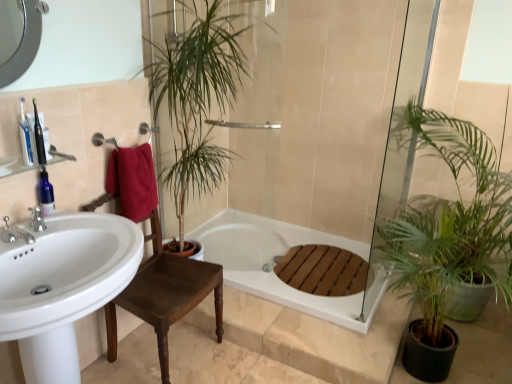
Question: Is brown wooden chair at center at the right side of brushed metal faucet at left, which appears as the 1th tap when viewed from the front?

Choices:
 (A) yes
 (B) no

Answer: (A)

Question: From a real-world perspective, is brown wooden chair at center under brushed metal faucet at left, which appears as the 1th tap when viewed from the front?

Choices:
 (A) yes
 (B) no

Answer: (A)

Question: Is brown wooden chair at center facing away from brushed metal faucet at left, which is the second tap in back-to-front order?

Choices:
 (A) no
 (B) yes

Answer: (A)

Question: From the image's perspective, is brown wooden chair at center under brushed metal faucet at left, which appears as the 1th tap when viewed from the front?

Choices:
 (A) yes
 (B) no

Answer: (A)

Question: Is brown wooden chair at center not close to brushed metal faucet at left, which is the second tap in back-to-front order?

Choices:
 (A) yes
 (B) no

Answer: (B)

Question: Does brown wooden chair at center have a lesser height compared to brushed metal faucet at left, which appears as the 1th tap when viewed from the front?

Choices:
 (A) no
 (B) yes

Answer: (A)

Question: From the image's perspective, is silver metallic faucet at left, the second tap viewed from the front, below translucent blue bottle at left, acting as the 1th toiletry starting from the back?

Choices:
 (A) no
 (B) yes

Answer: (B)

Question: Can you confirm if silver metallic faucet at left, the second tap viewed from the front, is taller than translucent blue bottle at left, acting as the 1th toiletry starting from the back?

Choices:
 (A) yes
 (B) no

Answer: (B)

Question: Is silver metallic faucet at left, the second tap viewed from the front, next to translucent blue bottle at left, the third toiletry positioned from the front, and touching it?

Choices:
 (A) yes
 (B) no

Answer: (A)

Question: Considering the relative positions of silver metallic faucet at left, acting as the first tap starting from the back, and translucent blue bottle at left, the third toiletry positioned from the front, in the image provided, is silver metallic faucet at left, acting as the first tap starting from the back, behind translucent blue bottle at left, the third toiletry positioned from the front,?

Choices:
 (A) no
 (B) yes

Answer: (A)

Question: From the image's perspective, is silver metallic faucet at left, acting as the first tap starting from the back, above translucent blue bottle at left, acting as the 1th toiletry starting from the back?

Choices:
 (A) yes
 (B) no

Answer: (B)

Question: Is silver metallic faucet at left, acting as the first tap starting from the back, looking in the opposite direction of translucent blue bottle at left, acting as the 1th toiletry starting from the back?

Choices:
 (A) yes
 (B) no

Answer: (B)

Question: Can you confirm if silver metallic faucet at left, acting as the first tap starting from the back, is bigger than white glossy sink at left?

Choices:
 (A) yes
 (B) no

Answer: (B)